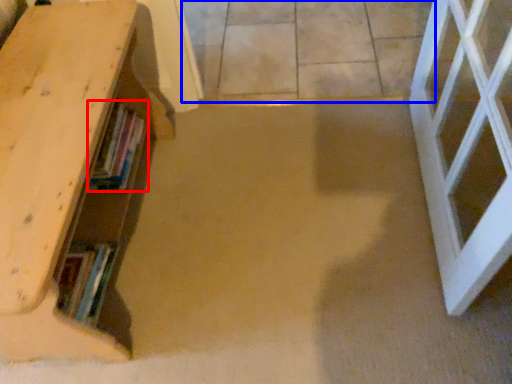
Question: Which object is further to the camera taking this photo, book (highlighted by a red box) or concrete (highlighted by a blue box)?

Choices:
 (A) book
 (B) concrete

Answer: (B)